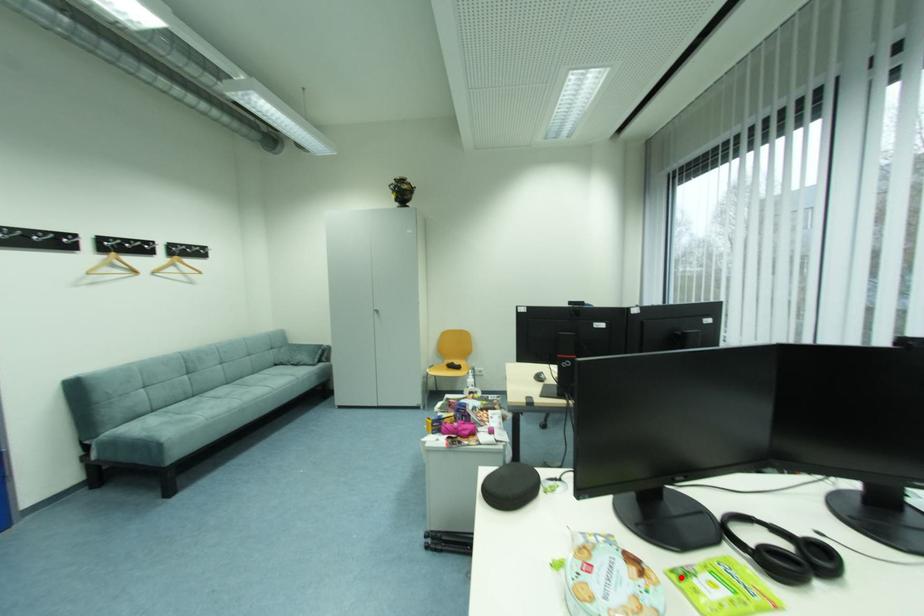
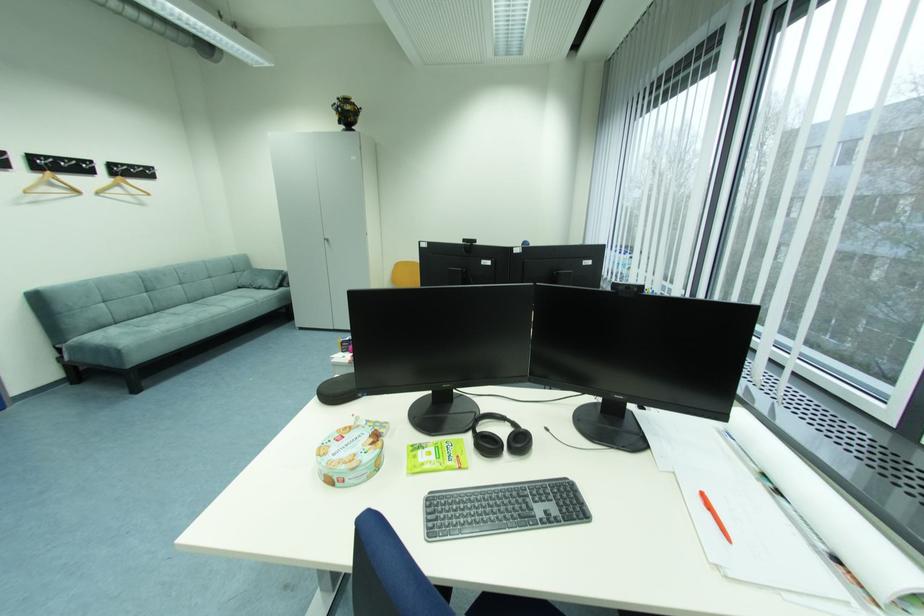
In the second image, find the point that corresponds to the highlighted location in the first image.

(418, 450)